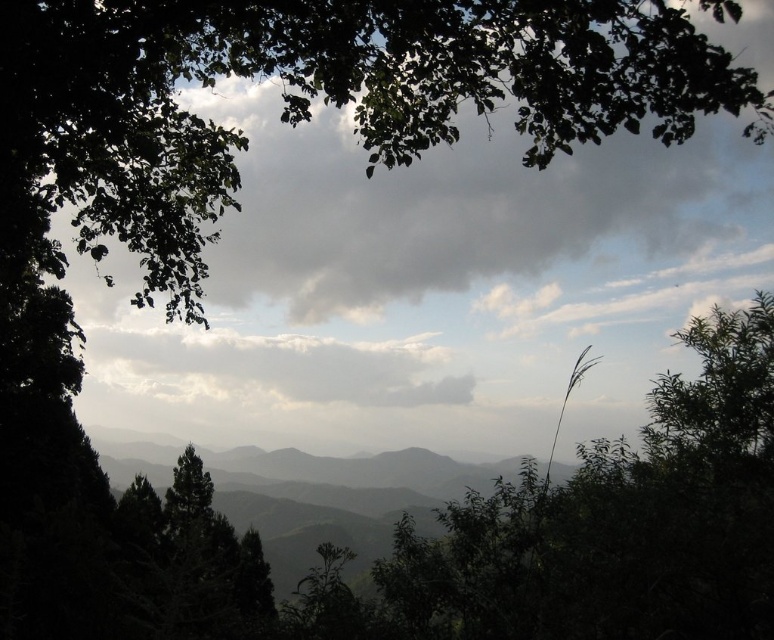
Question: Which point appears closest to the camera in this image?

Choices:
 (A) (348, 380)
 (B) (348, 180)

Answer: (B)

Question: Which of the following is the closest to the observer?

Choices:
 (A) white fluffy cloud at center
 (B) gray cloudy sky at upper center

Answer: (B)

Question: Does gray cloudy sky at upper center have a smaller size compared to white fluffy cloud at center?

Choices:
 (A) yes
 (B) no

Answer: (B)

Question: Is gray cloudy sky at upper center to the right of white fluffy cloud at center from the viewer's perspective?

Choices:
 (A) yes
 (B) no

Answer: (A)

Question: Is gray cloudy sky at upper center closer to camera compared to white fluffy cloud at center?

Choices:
 (A) yes
 (B) no

Answer: (A)

Question: Which point is farther to the camera?

Choices:
 (A) (401, 400)
 (B) (334, 196)

Answer: (A)